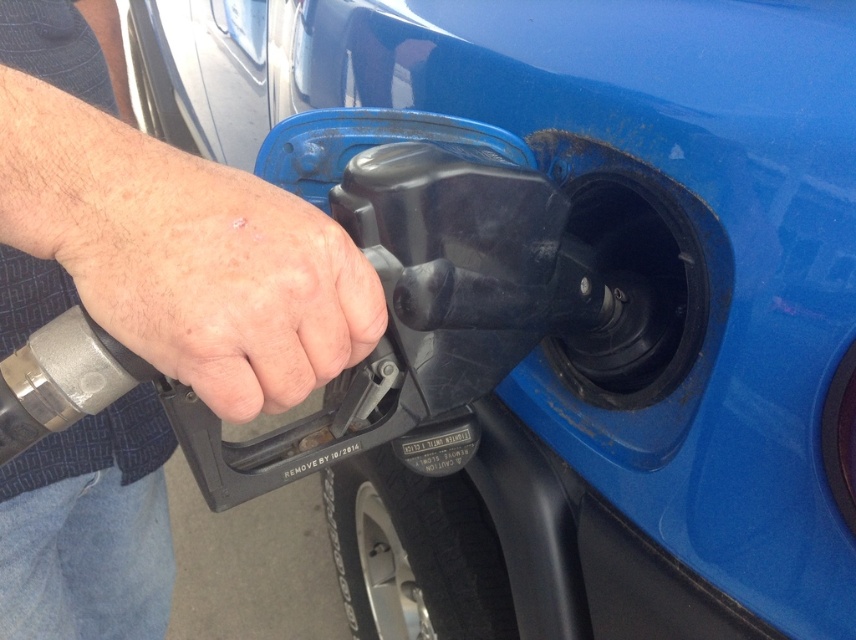
You are a mechanic inspecting a vehicle and its accessories. You notice the gray matte fuel nozzle at center and the dry skin at center. Which object is taller?

The gray matte fuel nozzle at center is taller than the dry skin at center.

You are a mechanic inspecting a fuel nozzle and a hand. The gray matte fuel nozzle at center is next to the dry skin at center. Can you determine if the fuel nozzle is wider than the dry skin?

The gray matte fuel nozzle at center might be wider than dry skin at center according to the description.